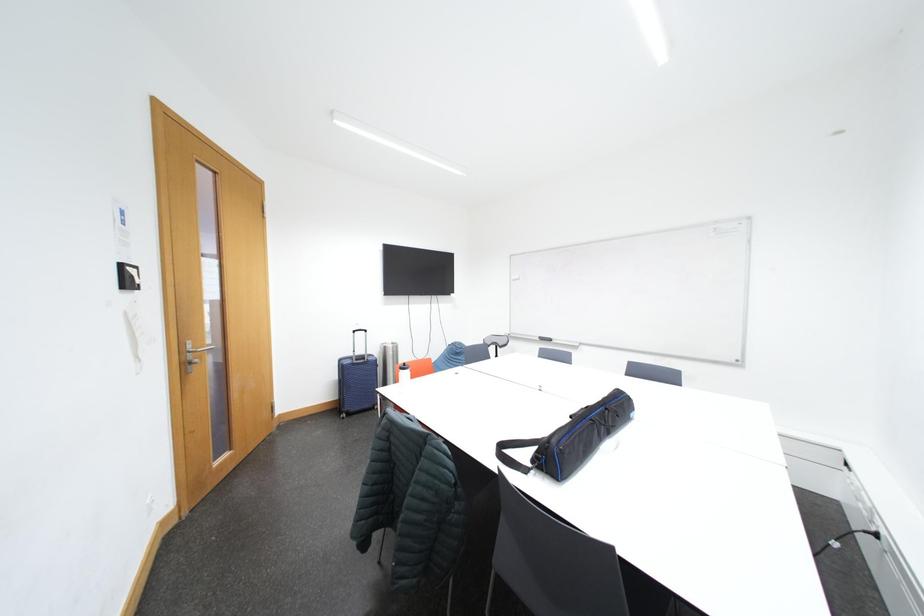
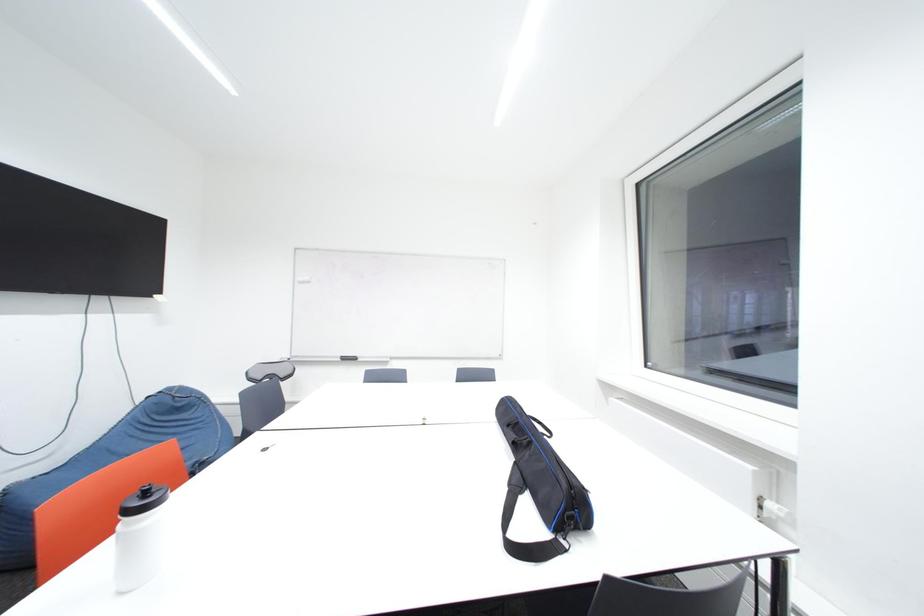
Question: The camera is either moving clockwise (left) or counter-clockwise (right) around the object. The first image is from the beginning of the video and the second image is from the end. Is the camera moving left or right when shooting the video?

Choices:
 (A) Left
 (B) Right

Answer: (A)